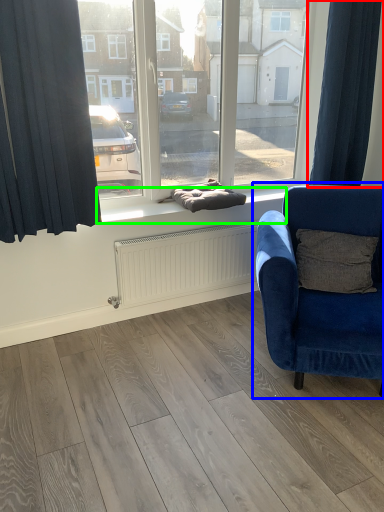
Question: Which object is positioned closest to curtain (highlighted by a red box)? Select from chair (highlighted by a blue box) and window sill (highlighted by a green box).

Choices:
 (A) chair
 (B) window sill

Answer: (B)